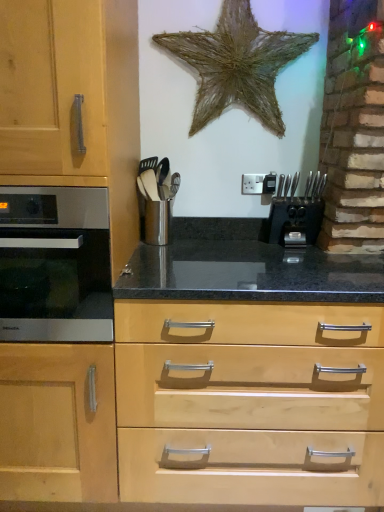
At what (x,y) coordinates should I click in order to perform the action: click on black plastic knife block at center right. Please return your answer as a coordinate pair (x, y). This screenshot has width=384, height=512. Looking at the image, I should click on (295, 219).

Does black plastic knife block at center right lie in front of satin silver oven at left?

That is False.

Is black plastic knife block at center right positioned with its back to satin silver oven at left?

That's not correct — black plastic knife block at center right is not looking away from satin silver oven at left.

How many degrees apart are the facing directions of black plastic knife block at center right and satin silver oven at left?

0.0007 degrees separate the facing orientations of black plastic knife block at center right and satin silver oven at left.

Where is `coffee machine above the satin silver oven at left (from a real-world perspective)`? coffee machine above the satin silver oven at left (from a real-world perspective) is located at coordinates (295, 219).

Which is in front, point (348, 360) or point (144, 200)?

Point (348, 360)

Considering the relative positions of light wood drawer at center and metallic silver utensil holder at center in the image provided, is light wood drawer at center in front of metallic silver utensil holder at center?

Yes, it is.

Who is bigger, light wood drawer at center or metallic silver utensil holder at center?

light wood drawer at center.

Could metallic silver utensil holder at center be considered to be inside light wood drawer at center?

No, metallic silver utensil holder at center is not surrounded by light wood drawer at center.

Looking at this image, from a real-world perspective, does satin silver oven at left stand above metallic silver utensil holder at center?

No.

Are satin silver oven at left and metallic silver utensil holder at center far apart?

They are positioned close to each other.

In order to click on oven on the left of metallic silver utensil holder at center in this screenshot , I will do `click(55, 264)`.

From their relative heights in the image, would you say satin silver oven at left is taller or shorter than metallic silver utensil holder at center?

satin silver oven at left is taller than metallic silver utensil holder at center.

From the image's perspective, is light wood drawer at center located above black plastic knife block at center right?

Actually, light wood drawer at center appears below black plastic knife block at center right in the image.

Is light wood drawer at center outside of black plastic knife block at center right?

Yes, light wood drawer at center is outside of black plastic knife block at center right.

What's the angular difference between light wood drawer at center and black plastic knife block at center right's facing directions?

0.00108 degrees separate the facing orientations of light wood drawer at center and black plastic knife block at center right.

Considering the points (25, 264) and (357, 371), which point is in front, point (25, 264) or point (357, 371)?

The point (25, 264) is more forward.

Is satin silver oven at left shorter than light wood drawer at center?

Yes, satin silver oven at left is shorter than light wood drawer at center.

Could you tell me if satin silver oven at left is facing light wood drawer at center?

No.

Can you tell me how much satin silver oven at left and black plastic knife block at center right differ in facing direction?

They differ by 0.0007 degrees in their facing directions.

Does point (16, 289) come in front of point (321, 207)?

Yes, it is.

Is satin silver oven at left directly adjacent to black plastic knife block at center right?

No, satin silver oven at left is not with black plastic knife block at center right.

From the image's perspective, relative to black plastic knife block at center right, is satin silver oven at left above or below?

From the image's perspective, satin silver oven at left appears below black plastic knife block at center right.

How many degrees apart are the facing directions of black plastic knife block at center right and metallic silver utensil holder at center?

black plastic knife block at center right and metallic silver utensil holder at center are facing 0.000776 degrees away from each other.

From a real-world perspective, is black plastic knife block at center right above or below metallic silver utensil holder at center?

From a real-world perspective, black plastic knife block at center right is physically below metallic silver utensil holder at center.

Which object is positioned more to the left, black plastic knife block at center right or metallic silver utensil holder at center?

Positioned to the left is metallic silver utensil holder at center.

From the picture: Is black plastic knife block at center right not inside metallic silver utensil holder at center?

Yes.

In order to click on oven located underneath the black plastic knife block at center right (from a real-world perspective) in this screenshot , I will do `click(55, 264)`.

Locate an element on the screen. Image resolution: width=384 pixels, height=512 pixels. appliance behind the light wood drawer at center is located at coordinates click(156, 199).

When comparing their distances from metallic silver utensil holder at center, does light wood drawer at center or black plastic knife block at center right seem closer?

The object closer to metallic silver utensil holder at center is black plastic knife block at center right.

Considering their positions, is black plastic knife block at center right positioned further to metallic silver utensil holder at center than light wood drawer at center?

The object further to metallic silver utensil holder at center is light wood drawer at center.

Looking at the image, which one is located further to black plastic knife block at center right, metallic silver utensil holder at center or light wood drawer at center?

light wood drawer at center is further to black plastic knife block at center right.

When comparing their distances from satin silver oven at left, does black plastic knife block at center right or metallic silver utensil holder at center seem further?

black plastic knife block at center right is positioned further to the anchor satin silver oven at left.

Based on their spatial positions, is light wood drawer at center or metallic silver utensil holder at center closer to satin silver oven at left?

Among the two, light wood drawer at center is located nearer to satin silver oven at left.

Estimate the real-world distances between objects in this image. Which object is further from light wood drawer at center, black plastic knife block at center right or metallic silver utensil holder at center?

metallic silver utensil holder at center is further to light wood drawer at center.

Looking at the image, which one is located closer to black plastic knife block at center right, light wood drawer at center or metallic silver utensil holder at center?

metallic silver utensil holder at center is positioned closer to the anchor black plastic knife block at center right.

When comparing their distances from metallic silver utensil holder at center, does satin silver oven at left or light wood drawer at center seem further?

light wood drawer at center.

At what (x,y) coordinates should I click in order to perform the action: click on appliance between satin silver oven at left and black plastic knife block at center right from left to right. Please return your answer as a coordinate pair (x, y). Looking at the image, I should click on (156, 199).

Locate an element on the screen. coffee machine between metallic silver utensil holder at center and light wood drawer at center in the up-down direction is located at coordinates (295, 219).

Find the location of a particular element. Image resolution: width=384 pixels, height=512 pixels. drawer located between satin silver oven at left and black plastic knife block at center right in the left-right direction is located at coordinates (250, 403).

This screenshot has width=384, height=512. Find the location of `appliance between satin silver oven at left and light wood drawer at center`. appliance between satin silver oven at left and light wood drawer at center is located at coordinates (156, 199).